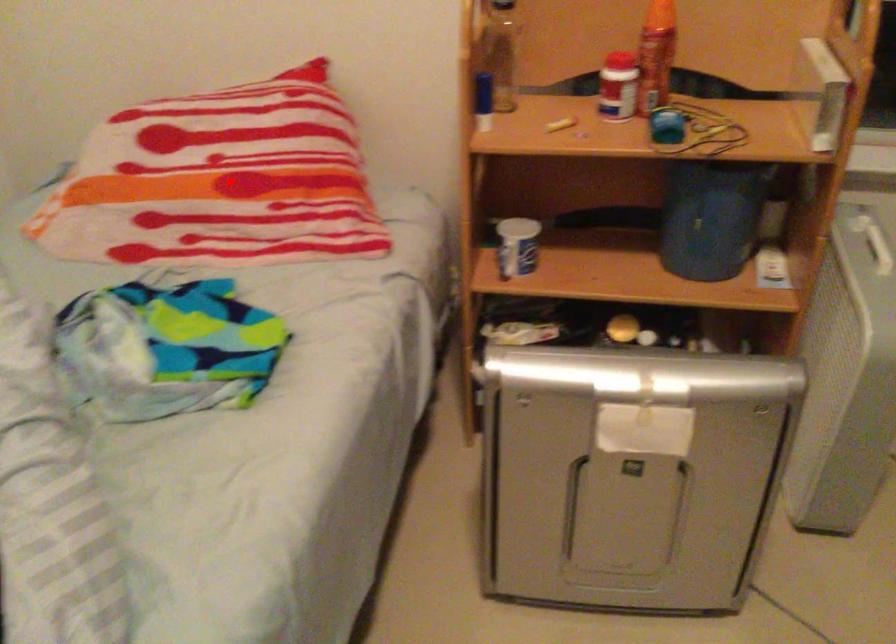
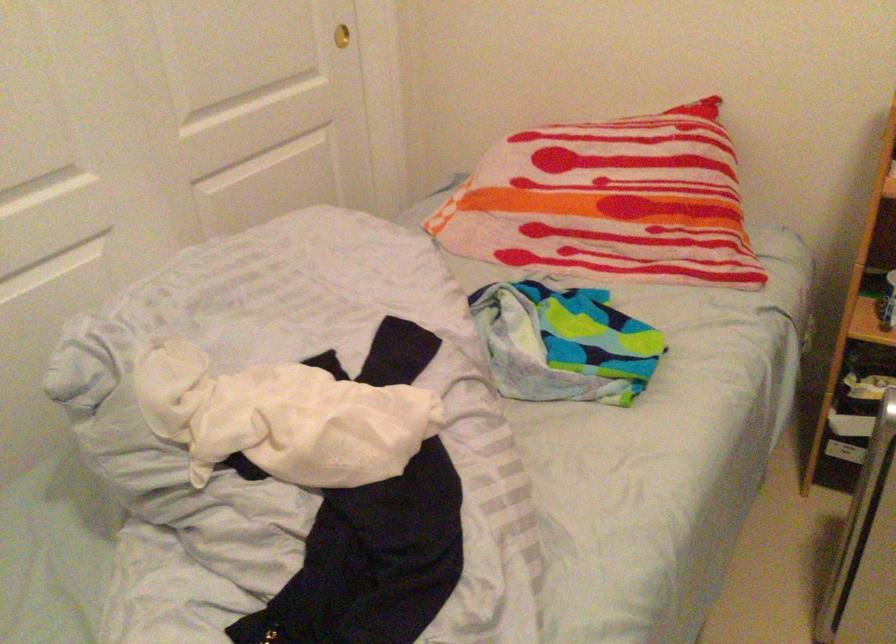
The point at the highlighted location is marked in the first image. Where is the corresponding point in the second image?

(608, 202)